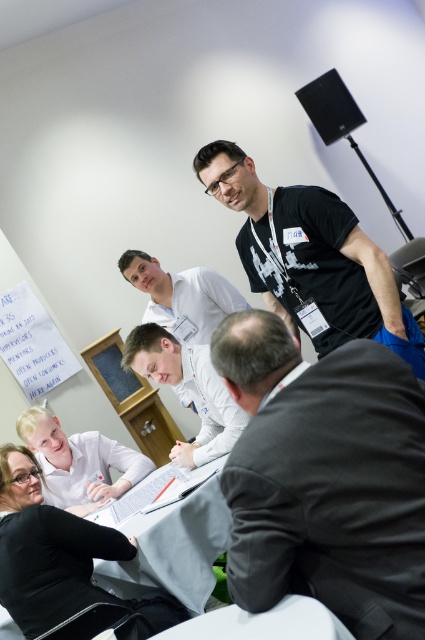
Question: Where is dark gray suit at lower right located in relation to white smooth shirt at center in the image?

Choices:
 (A) left
 (B) right

Answer: (B)

Question: Which of these objects is positioned closest to the white smooth shirt at center?

Choices:
 (A) white fabric table at center
 (B) black fabric shirt at lower left
 (C) white shirt at center
 (D) light blue shirt at lower left

Answer: (A)

Question: Which of the following is the closest to the observer?

Choices:
 (A) white smooth shirt at center
 (B) black matte t-shirt at upper right
 (C) white shirt at center
 (D) dark gray suit at lower right

Answer: (D)

Question: Can you confirm if white smooth shirt at center is positioned below white shirt at center?

Choices:
 (A) no
 (B) yes

Answer: (B)

Question: Does dark gray suit at lower right appear over white smooth shirt at center?

Choices:
 (A) yes
 (B) no

Answer: (A)

Question: Among these objects, which one is farthest from the camera?

Choices:
 (A) black matte t-shirt at upper right
 (B) black fabric shirt at lower left
 (C) dark gray suit at lower right

Answer: (B)